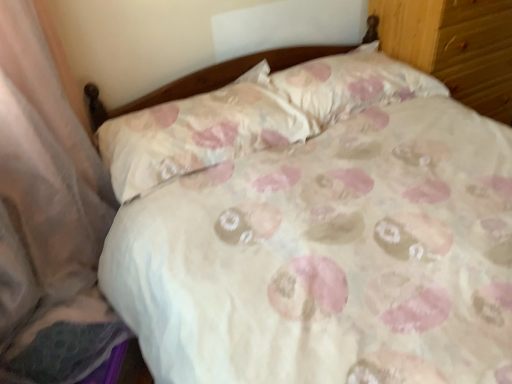
Question: Which direction should I rotate to look at white fabric pillow at center, the 2th pillow in the right-to-left sequence?

Choices:
 (A) left
 (B) right

Answer: (A)

Question: Considering the relative positions of white fabric pillow at center, which is counted as the 1th pillow, starting from the left, and wooden dresser at upper right in the image provided, is white fabric pillow at center, which is counted as the 1th pillow, starting from the left, to the left of wooden dresser at upper right from the viewer's perspective?

Choices:
 (A) no
 (B) yes

Answer: (B)

Question: Does white fabric pillow at center, the 2th pillow in the right-to-left sequence, have a lesser height compared to wooden dresser at upper right?

Choices:
 (A) no
 (B) yes

Answer: (B)

Question: Can you confirm if white fabric pillow at center, the 2th pillow in the right-to-left sequence, is bigger than wooden dresser at upper right?

Choices:
 (A) yes
 (B) no

Answer: (B)

Question: From a real-world perspective, does white fabric pillow at center, the 2th pillow in the right-to-left sequence, sit lower than wooden dresser at upper right?

Choices:
 (A) no
 (B) yes

Answer: (A)

Question: Is white fabric pillow at center, the 2th pillow in the right-to-left sequence, further to camera compared to wooden dresser at upper right?

Choices:
 (A) yes
 (B) no

Answer: (B)

Question: From the image's perspective, does white fabric pillow at center, which is counted as the 1th pillow, starting from the left, appear higher than wooden dresser at upper right?

Choices:
 (A) no
 (B) yes

Answer: (A)

Question: Is floral fabric pillow at upper center, placed as the first pillow when sorted from right to left, bigger than wooden dresser at upper right?

Choices:
 (A) yes
 (B) no

Answer: (B)

Question: Can wooden dresser at upper right be found inside floral fabric pillow at upper center, placed as the first pillow when sorted from right to left?

Choices:
 (A) no
 (B) yes

Answer: (A)

Question: Is floral fabric pillow at upper center, placed as the first pillow when sorted from right to left, thinner than wooden dresser at upper right?

Choices:
 (A) no
 (B) yes

Answer: (B)

Question: From a real-world perspective, is floral fabric pillow at upper center, placed as the first pillow when sorted from right to left, positioned under wooden dresser at upper right based on gravity?

Choices:
 (A) yes
 (B) no

Answer: (B)

Question: From the image's perspective, is floral fabric pillow at upper center, the 2th pillow in the left-to-right sequence, over wooden dresser at upper right?

Choices:
 (A) yes
 (B) no

Answer: (B)

Question: Is floral fabric pillow at upper center, the 2th pillow in the left-to-right sequence, wider than wooden dresser at upper right?

Choices:
 (A) yes
 (B) no

Answer: (B)

Question: Is the surface of floral fabric pillow at upper center, placed as the first pillow when sorted from right to left, in direct contact with white fabric pillow at center, the 2th pillow in the right-to-left sequence?

Choices:
 (A) yes
 (B) no

Answer: (B)